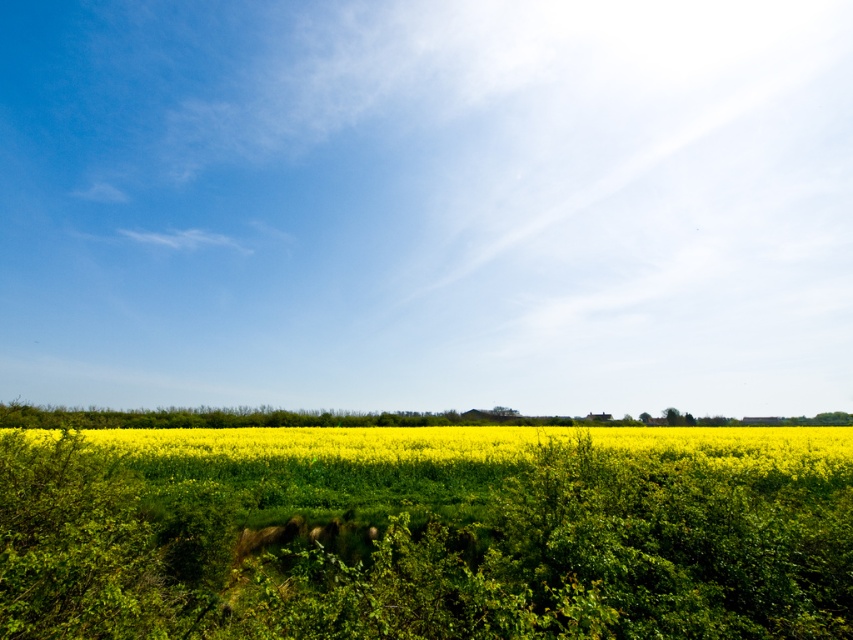
You are standing in the middle of the rapeseed field and looking straight ahead. Which object, the blue sky at upper center or the yellow matte flower at center, is closer to your eyes?

The yellow matte flower at center is closer to your eyes because the blue sky at upper center is further away from you.